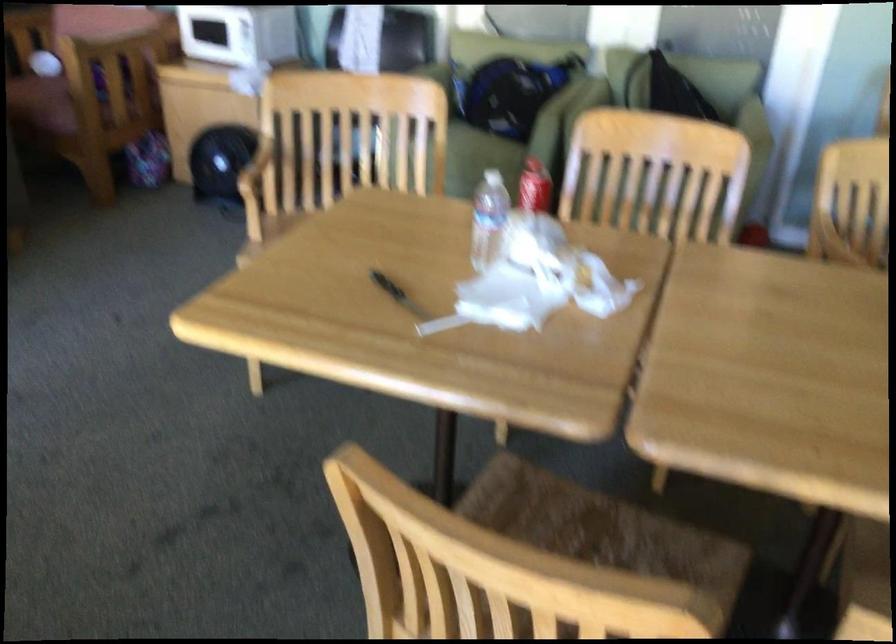
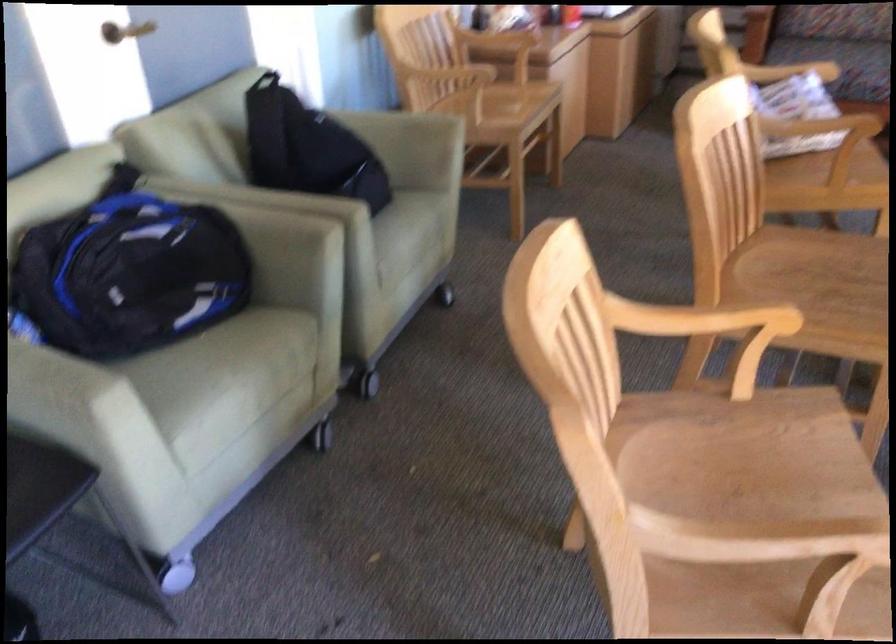
In the second image, find the point that corresponds to (x=648, y=98) in the first image.

(307, 147)